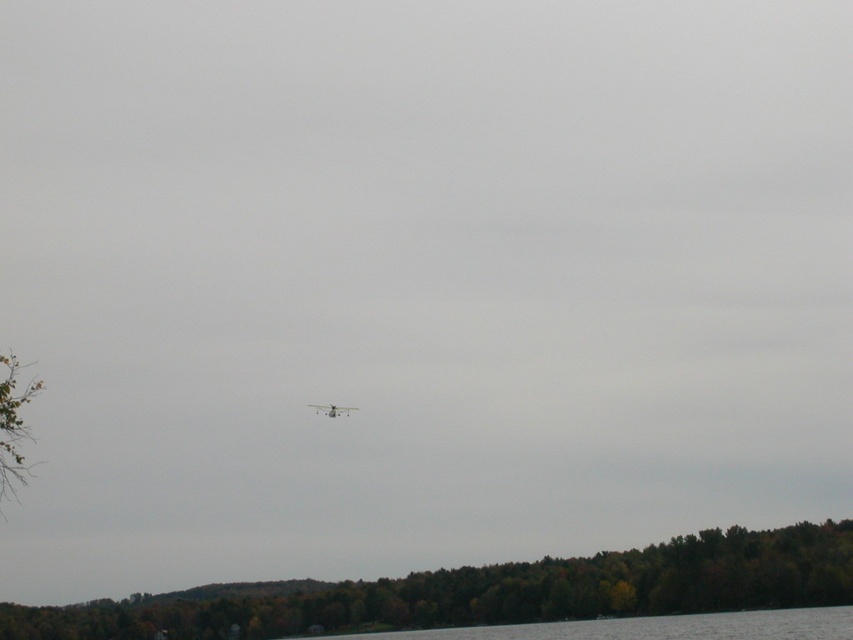
Looking at this image, you are a pilot flying the metallic silver airplane at center and want to avoid hitting the green leafy tree at left. Based on the scene, which direction should you adjust your flight path to safely descend?

The green leafy tree at left is located above the metallic silver airplane at center, so to avoid collision, you should adjust your flight path downward to descend below the tree.

Looking at this image, you are a pilot flying the metallic silver airplane at center and want to land on the clear water at lower center. Can you safely land the plane on the water based on the scene?

The clear water at lower center is much taller than the metallic silver airplane at center, so the plane can safely land on the water as there is sufficient space.

You are a bird flying at the same height as the metallic silver airplane at center. Can you see the top of the green leafy tree at left without changing your flight path?

The green leafy tree at left is not as tall as the metallic silver airplane at center, so yes, you can see the top of the green leafy tree at left from your current position without changing your flight path.